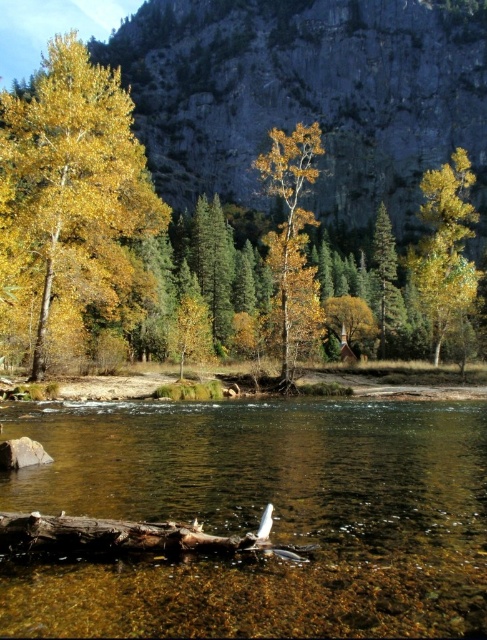
Which is in front, point (461, 173) or point (380, 252)?

Positioned in front is point (461, 173).

Can you confirm if yellow matte tree at right is thinner than green matte tree at center?

Incorrect, yellow matte tree at right's width is not less than green matte tree at center's.

Locate an element on the screen. Image resolution: width=487 pixels, height=640 pixels. yellow matte tree at right is located at coordinates (445, 246).

Based on the photo, is clear water at center thinner than brown rough log at lower center?

In fact, clear water at center might be wider than brown rough log at lower center.

Between clear water at center and brown rough log at lower center, which one has more height?

Standing taller between the two is clear water at center.

Locate an element on the screen. The height and width of the screenshot is (640, 487). clear water at center is located at coordinates (260, 515).

The image size is (487, 640). Identify the location of clear water at center. click(260, 515).

The image size is (487, 640). Find the location of `golden yellow leaves at center`. golden yellow leaves at center is located at coordinates (293, 237).

Consider the image. Is golden yellow leaves at center further to camera compared to yellow matte tree at right?

No, golden yellow leaves at center is closer to the viewer.

This screenshot has height=640, width=487. What do you see at coordinates (293, 237) in the screenshot?
I see `golden yellow leaves at center` at bounding box center [293, 237].

You are a GUI agent. You are given a task and a screenshot of the screen. Output one action in this format:
    pyautogui.click(x=<x>, y=<y>)
    Task: Click on the golden yellow leaves at center
    The width and height of the screenshot is (487, 640).
    Given the screenshot: What is the action you would take?
    pyautogui.click(x=293, y=237)